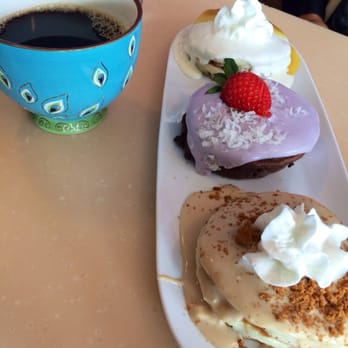
The width and height of the screenshot is (348, 348). Find the location of `dish`. dish is located at coordinates (169, 180).